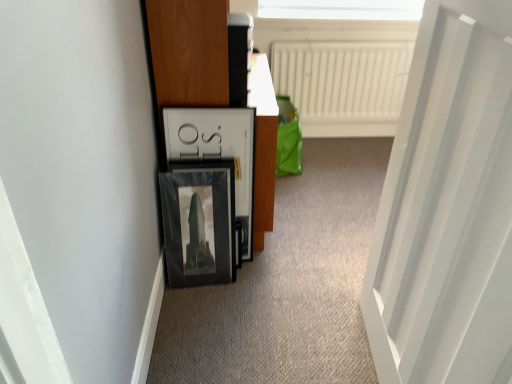
This screenshot has height=384, width=512. Identify the location of white smooth door at right. (447, 207).

This screenshot has height=384, width=512. Identify the location of white matte radiator at upper center. (342, 79).

Where is `white smooth door at right`? The height and width of the screenshot is (384, 512). white smooth door at right is located at coordinates (447, 207).

Is white matte radiator at upper center turned away from white smooth door at right?

No, white matte radiator at upper center's orientation is not away from white smooth door at right.

Is white matte radiator at upper center inside the boundaries of white smooth door at right, or outside?

white matte radiator at upper center cannot be found inside white smooth door at right.

Is white matte radiator at upper center with white smooth door at right?

No, white matte radiator at upper center is not next to white smooth door at right.

From the image's perspective, which is below, white matte radiator at upper center or white smooth door at right?

From the image's view, white smooth door at right is below.

From the picture: Is white smooth door at right spatially inside white matte radiator at upper center, or outside of it?

white smooth door at right is spatially situated outside white matte radiator at upper center.

Can you tell me how much white smooth door at right and white matte radiator at upper center differ in facing direction?

There is a 88.6-degree angle between the facing directions of white smooth door at right and white matte radiator at upper center.

Is the position of white smooth door at right less distant than that of white matte radiator at upper center?

Yes, white smooth door at right is in front of white matte radiator at upper center.

Which is closer to the camera, (209, 16) or (383, 103)?

The point (209, 16) is more forward.

Considering the sizes of objects wooden dresser at left and white matte radiator at upper center in the image provided, who is bigger, wooden dresser at left or white matte radiator at upper center?

With larger size is wooden dresser at left.

Is wooden dresser at left thinner than white matte radiator at upper center?

In fact, wooden dresser at left might be wider than white matte radiator at upper center.

This screenshot has height=384, width=512. What are the coordinates of `dresser on the left of the white matte radiator at upper center` in the screenshot? It's located at (189, 52).

Identify the location of dresser behind the white smooth door at right. (189, 52).

From a real-world perspective, which is physically below, wooden dresser at left or white smooth door at right?

wooden dresser at left.

Would you say wooden dresser at left is outside white smooth door at right?

wooden dresser at left is positioned outside white smooth door at right.

Does white matte radiator at upper center appear on the left side of wooden dresser at left?

No, white matte radiator at upper center is not to the left of wooden dresser at left.

Is white matte radiator at upper center placed right next to wooden dresser at left?

No, white matte radiator at upper center is not touching wooden dresser at left.

Is white matte radiator at upper center wider than wooden dresser at left?

In fact, white matte radiator at upper center might be narrower than wooden dresser at left.

Based on the photo, is wooden dresser at left inside white matte radiator at upper center?

No, wooden dresser at left is located outside of white matte radiator at upper center.

Where is `door on the right of the wooden dresser at left`? This screenshot has width=512, height=384. door on the right of the wooden dresser at left is located at coordinates (447, 207).

Is point (448, 16) less distant than point (175, 101)?

Yes.

Is white smooth door at right smaller than wooden dresser at left?

Yes.

What's the angular difference between white smooth door at right and wooden dresser at left's facing directions?

There is a 2.32-degree angle between the facing directions of white smooth door at right and wooden dresser at left.

The image size is (512, 384). In order to click on radiator to the right of white smooth door at right in this screenshot , I will do click(x=342, y=79).

Locate an element on the screen. Image resolution: width=512 pixels, height=384 pixels. door located on the left of white matte radiator at upper center is located at coordinates (447, 207).

Looking at the image, which one is located closer to white matte radiator at upper center, white smooth door at right or wooden dresser at left?

The object closer to white matte radiator at upper center is wooden dresser at left.

Which object lies further to the anchor point white smooth door at right, white matte radiator at upper center or wooden dresser at left?

Among the two, white matte radiator at upper center is located further to white smooth door at right.

Looking at the image, which one is located closer to wooden dresser at left, white matte radiator at upper center or white smooth door at right?

white smooth door at right.

Estimate the real-world distances between objects in this image. Which object is closer to white smooth door at right, wooden dresser at left or white matte radiator at upper center?

wooden dresser at left lies closer to white smooth door at right than the other object.

When comparing their distances from wooden dresser at left, does white smooth door at right or white matte radiator at upper center seem closer?

Based on the image, white smooth door at right appears to be nearer to wooden dresser at left.

Which object lies nearer to the anchor point white matte radiator at upper center, wooden dresser at left or white smooth door at right?

The object closer to white matte radiator at upper center is wooden dresser at left.

Locate an element on the screen. Image resolution: width=512 pixels, height=384 pixels. dresser between white smooth door at right and white matte radiator at upper center from front to back is located at coordinates coord(189,52).